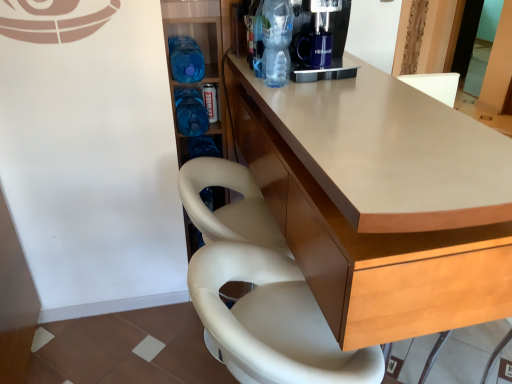
The width and height of the screenshot is (512, 384). Identify the location of blue plastic bottle at center-left, the second bottle positioned from the back. (186, 59).

What is the approximate width of blue plastic water bottles at left?

blue plastic water bottles at left is 20.98 inches in width.

I want to click on white leather chair at lower center, so click(x=260, y=290).

How much space does translucent plastic bottle at upper center, which appears as the 1th bottle when viewed from the right, occupy horizontally?

translucent plastic bottle at upper center, which appears as the 1th bottle when viewed from the right, is 3.68 inches wide.

In order to click on blue plastic bottle at center-left, which appears as the first bottle when viewed from the left in this screenshot , I will do `click(186, 59)`.

Is matte wood counter at center smaller than translucent plastic bottle at upper center, which appears as the 1th bottle when viewed from the right?

Incorrect, matte wood counter at center is not smaller in size than translucent plastic bottle at upper center, which appears as the 1th bottle when viewed from the right.

Is matte wood counter at center shorter than translucent plastic bottle at upper center, which appears as the first bottle when viewed from the front?

In fact, matte wood counter at center may be taller than translucent plastic bottle at upper center, which appears as the first bottle when viewed from the front.

Considering their positions, is matte wood counter at center located in front of or behind translucent plastic bottle at upper center, which appears as the 1th bottle when viewed from the right?

Clearly, matte wood counter at center is in front of translucent plastic bottle at upper center, which appears as the 1th bottle when viewed from the right.

Between point (184, 109) and point (187, 63), which one is positioned in front?

The point (187, 63) is closer.

Measure the distance between blue plastic bottle at center-left, placed as the third bottle when sorted from front to back, and blue plastic bottle at center-left, the 3th bottle positioned from the right.

blue plastic bottle at center-left, placed as the third bottle when sorted from front to back, is 5.05 inches from blue plastic bottle at center-left, the 3th bottle positioned from the right.

Does blue plastic bottle at center-left, placed as the third bottle when sorted from front to back, have a greater width compared to blue plastic bottle at center-left, marked as the 2th bottle in a front-to-back arrangement?

Correct, the width of blue plastic bottle at center-left, placed as the third bottle when sorted from front to back, exceeds that of blue plastic bottle at center-left, marked as the 2th bottle in a front-to-back arrangement.

Is blue plastic bottle at center-left, acting as the first bottle starting from the back, placed right next to blue plastic bottle at center-left, the second bottle positioned from the back?

blue plastic bottle at center-left, acting as the first bottle starting from the back, and blue plastic bottle at center-left, the second bottle positioned from the back, are clearly separated.

Which is behind, point (212, 78) or point (302, 200)?

The point (212, 78) is more distant.

Does blue plastic water bottles at left contain matte wood counter at center?

Actually, matte wood counter at center is outside blue plastic water bottles at left.

Is blue plastic water bottles at left far from matte wood counter at center?

No, blue plastic water bottles at left is not far away from matte wood counter at center.

Is blue plastic water bottles at left spatially inside blue plastic bottle at center-left, arranged as the 2th bottle when viewed from the right, or outside of it?

blue plastic water bottles at left exists outside the volume of blue plastic bottle at center-left, arranged as the 2th bottle when viewed from the right.

Would you consider blue plastic water bottles at left to be distant from blue plastic bottle at center-left, placed as the third bottle when sorted from front to back?

blue plastic water bottles at left is near blue plastic bottle at center-left, placed as the third bottle when sorted from front to back, not far away.

From a real-world perspective, which object rests below the other?

From a 3D spatial view, blue plastic water bottles at left is below.

From the picture: Is blue plastic water bottles at left aimed at blue plastic bottle at center-left, placed as the third bottle when sorted from front to back?

Yes, blue plastic water bottles at left is facing blue plastic bottle at center-left, placed as the third bottle when sorted from front to back.

Based on the photo, from a real-world perspective, relative to blue plastic water bottles at left, is blue plastic bottle at center-left, placed as the third bottle when sorted from front to back, vertically above or below?

In terms of real-world spatial position, blue plastic bottle at center-left, placed as the third bottle when sorted from front to back, is above blue plastic water bottles at left.

Which of these two, blue plastic bottle at center-left, which is the second bottle in left-to-right order, or blue plastic water bottles at left, is wider?

blue plastic water bottles at left is wider.

Does blue plastic bottle at center-left, arranged as the 2th bottle when viewed from the right, have a greater height compared to blue plastic water bottles at left?

No.

Is the depth of matte wood counter at center greater than that of white leather chair at lower center?

Answer: No, it is in front of white leather chair at lower center.

Is matte wood counter at center oriented away from white leather chair at lower center?

That's right, matte wood counter at center is facing away from white leather chair at lower center.

Can you confirm if matte wood counter at center is thinner than white leather chair at lower center?

In fact, matte wood counter at center might be wider than white leather chair at lower center.

Does blue plastic bottle at center-left, marked as the 2th bottle in a front-to-back arrangement, appear on the right side of matte wood counter at center?

Incorrect, blue plastic bottle at center-left, marked as the 2th bottle in a front-to-back arrangement, is not on the right side of matte wood counter at center.

Is blue plastic bottle at center-left, the second bottle positioned from the back, not close to matte wood counter at center?

No, blue plastic bottle at center-left, the second bottle positioned from the back, is not far away from matte wood counter at center.

Is blue plastic bottle at center-left, the 3th bottle positioned from the right, situated inside matte wood counter at center or outside?

blue plastic bottle at center-left, the 3th bottle positioned from the right, is spatially situated outside matte wood counter at center.

I want to click on cabinetry below the blue plastic bottle at center-left, which appears as the first bottle when viewed from the left (from the image's perspective), so click(368, 243).

Where is `cabinetry below the translucent plastic bottle at upper center, which appears as the 3th bottle when viewed from the back (from a real-world perspective)`? The width and height of the screenshot is (512, 384). cabinetry below the translucent plastic bottle at upper center, which appears as the 3th bottle when viewed from the back (from a real-world perspective) is located at coordinates (368, 243).

Locate an element on the screen. the 1st bottle to the right when counting from the blue plastic bottle at center-left, the second bottle positioned from the back is located at coordinates (190, 112).

Considering their positions, is blue plastic bottle at center-left, marked as the 2th bottle in a front-to-back arrangement, positioned closer to matte wood counter at center than blue plastic bottle at center-left, which is the second bottle in left-to-right order?

blue plastic bottle at center-left, which is the second bottle in left-to-right order, is positioned closer to the anchor matte wood counter at center.

Which object lies nearer to the anchor point blue plastic water bottles at left, white leather chair at lower center or blue plastic bottle at center-left, which is the second bottle in left-to-right order?

Among the two, blue plastic bottle at center-left, which is the second bottle in left-to-right order, is located nearer to blue plastic water bottles at left.

Estimate the real-world distances between objects in this image. Which object is closer to white leather chair at lower center, blue plastic bottle at center-left, marked as the 2th bottle in a front-to-back arrangement, or blue plastic water bottles at left?

blue plastic water bottles at left.

Based on their spatial positions, is matte wood counter at center or blue plastic water bottles at left further from blue plastic bottle at center-left, the 3th bottle positioned from the right?

Based on the image, matte wood counter at center appears to be further to blue plastic bottle at center-left, the 3th bottle positioned from the right.

Estimate the real-world distances between objects in this image. Which object is further from matte wood counter at center, blue plastic water bottles at left or blue plastic bottle at center-left, the 3th bottle positioned from the right?

blue plastic bottle at center-left, the 3th bottle positioned from the right, lies further to matte wood counter at center than the other object.

When comparing their distances from blue plastic bottle at center-left, which appears as the first bottle when viewed from the left, does blue plastic bottle at center-left, acting as the first bottle starting from the back, or matte wood counter at center seem further?

matte wood counter at center is positioned further to the anchor blue plastic bottle at center-left, which appears as the first bottle when viewed from the left.

Looking at this image, when comparing their distances from blue plastic bottle at center-left, which appears as the first bottle when viewed from the left, does blue plastic water bottles at left or translucent plastic bottle at upper center, which appears as the 3th bottle when viewed from the back, seem closer?

Based on the image, blue plastic water bottles at left appears to be nearer to blue plastic bottle at center-left, which appears as the first bottle when viewed from the left.

Considering their positions, is matte wood counter at center positioned closer to white leather chair at lower center than blue plastic bottle at center-left, marked as the 2th bottle in a front-to-back arrangement?

matte wood counter at center is closer to white leather chair at lower center.

The height and width of the screenshot is (384, 512). Identify the location of shelf between translucent plastic bottle at upper center, which appears as the 1th bottle when viewed from the right, and white leather chair at lower center vertically. (204, 59).

Locate an element on the screen. The image size is (512, 384). shelf between translucent plastic bottle at upper center, the third bottle in the left-to-right sequence, and blue plastic bottle at center-left, arranged as the 2th bottle when viewed from the right, in the front-back direction is located at coordinates (204, 59).

This screenshot has width=512, height=384. I want to click on bottle between translucent plastic bottle at upper center, which appears as the 3th bottle when viewed from the back, and blue plastic bottle at center-left, arranged as the 2th bottle when viewed from the right, in the front-back direction, so click(x=186, y=59).

Identify the location of chair located between matte wood counter at center and blue plastic water bottles at left in the depth direction. This screenshot has width=512, height=384. (260, 290).